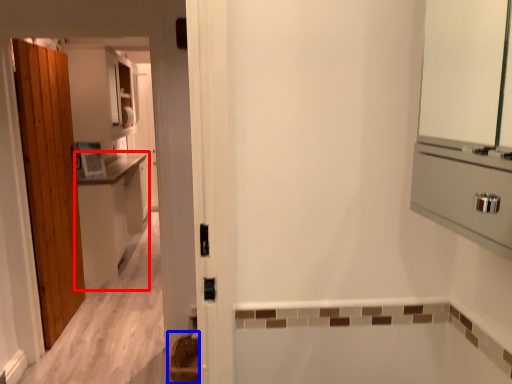
Question: Which object is further to the camera taking this photo, cabinetry (highlighted by a red box) or basket (highlighted by a blue box)?

Choices:
 (A) cabinetry
 (B) basket

Answer: (A)